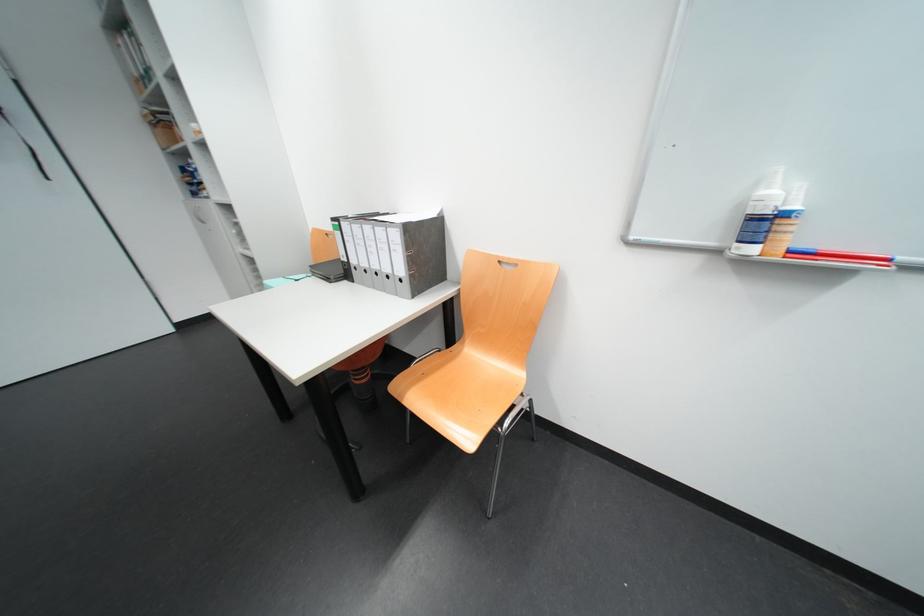
Which object does [850,257] point to?

It corresponds to the blue whiteboard marker in the image.